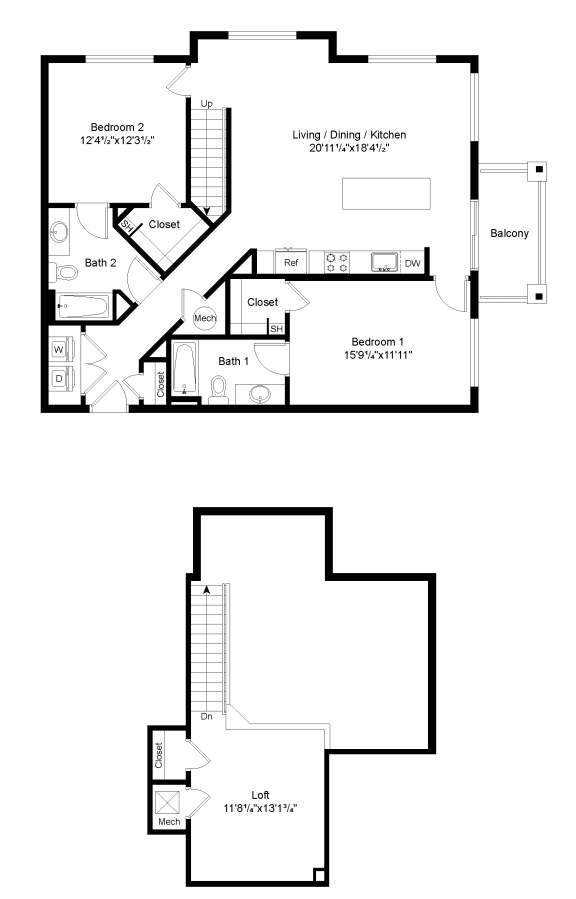
Find the location of a particular element. The width and height of the screenshot is (576, 899). interior wall is located at coordinates (237, 723).